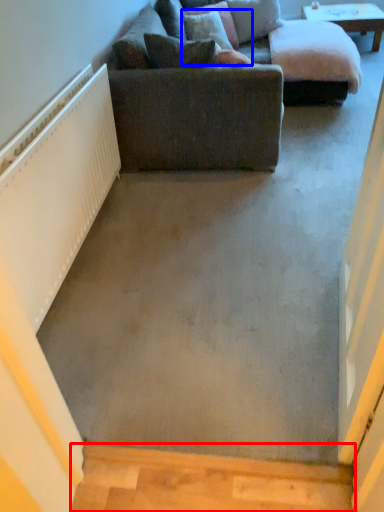
Question: Which object appears farthest to the camera in this image, stairwell (highlighted by a red box) or pillow (highlighted by a blue box)?

Choices:
 (A) stairwell
 (B) pillow

Answer: (B)